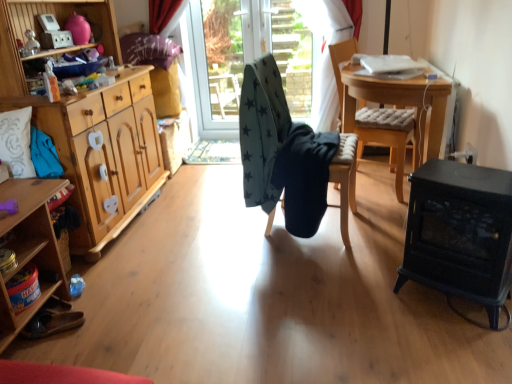
Locate an element on the screen. This screenshot has height=384, width=512. free space in front of teal star-patterned fabric at center, placed as the third chair when sorted from right to left is located at coordinates (316, 271).